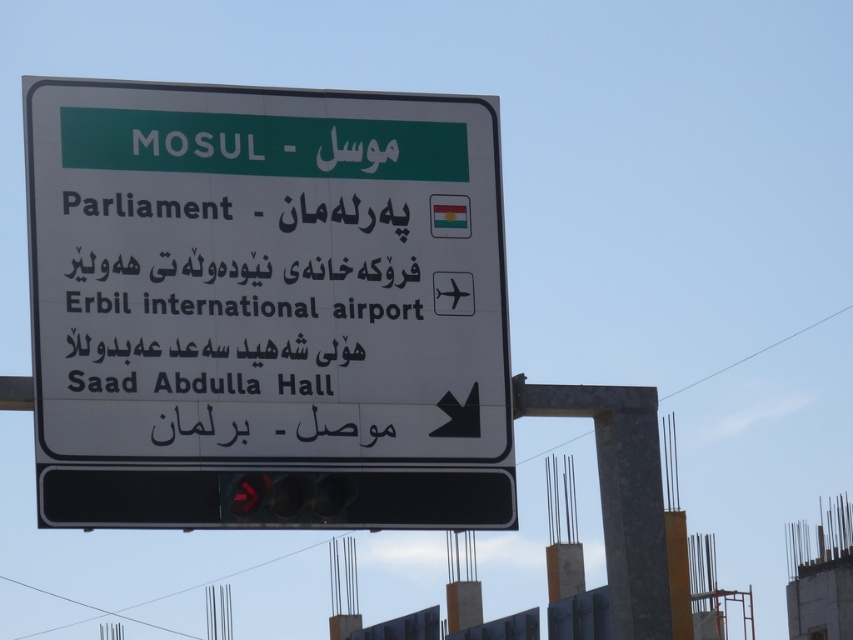
What is located at the coordinates point (265, 301)?

The point (265, 301) corresponds to a white plastic sign at center.

You are a delivery driver who needs to pick up a package from the red glass traffic light at bottom center and deliver it to the white plastic sign at center. Can you reach the destination without moving the package?

The white plastic sign at center and red glass traffic light at bottom center are 3.07 meters apart, so yes, you can reach the destination without moving the package since the distance is manageable.

You are a tourist in Mosul and see the white plastic sign at center and the black text at center. Which object is positioned higher up?

The white plastic sign at center is located above the black text at center, so it is positioned higher up.